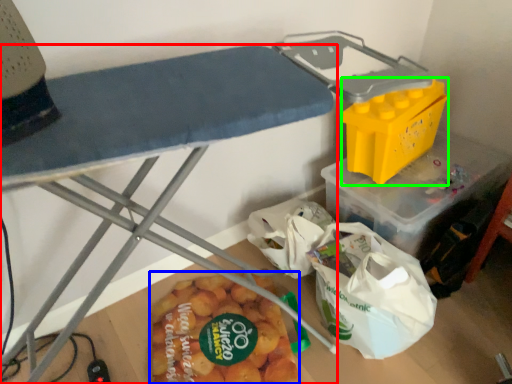
Question: Considering the real-world distances, which object is farthest from furniture (highlighted by a red box)? food (highlighted by a blue box) or box (highlighted by a green box)?

Choices:
 (A) food
 (B) box

Answer: (B)